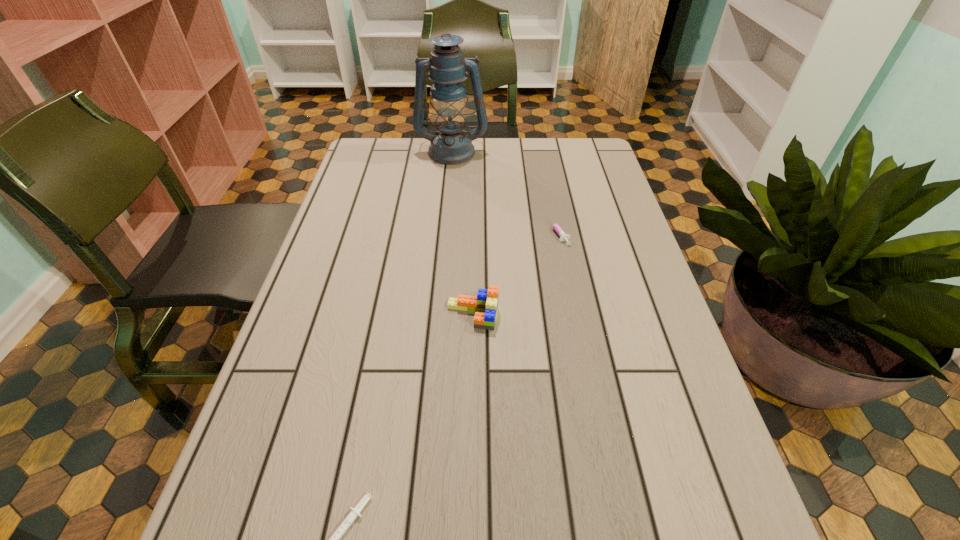
In the image, there is a desktop. At what (x,y) coordinates should I click in order to perform the action: click on free space at the far edge. Please return your answer as a coordinate pair (x, y). Looking at the image, I should click on click(x=455, y=176).

Image resolution: width=960 pixels, height=540 pixels. In the image, there is a desktop. In order to click on vacant space at the left edge in this screenshot , I will do `click(274, 422)`.

Image resolution: width=960 pixels, height=540 pixels. In the image, there is a desktop. Find the location of `vacant region at the right edge`. vacant region at the right edge is located at coordinates (682, 445).

Find the location of `free region at the far left corner of the desktop`. free region at the far left corner of the desktop is located at coordinates pos(404,141).

Find the location of `vacant area at the far right corner of the desktop`. vacant area at the far right corner of the desktop is located at coordinates (564, 168).

Locate an element on the screen. Image resolution: width=960 pixels, height=540 pixels. vacant point located between the farthest object and the second tallest object is located at coordinates (463, 233).

Locate an element on the screen. The width and height of the screenshot is (960, 540). empty space that is in between the third farthest object and the taller syringe is located at coordinates (516, 274).

Locate an element on the screen. This screenshot has width=960, height=540. vacant space that is in between the third shortest object and the right syringe is located at coordinates (516, 274).

In order to click on the third closest object relative to the farthest object in this screenshot , I will do `click(335, 538)`.

Identify which object is the third closest to the shortest object. Please provide its 2D coordinates. Your answer should be formatted as a tuple, i.e. [(x, y)], where the tuple contains the x and y coordinates of a point satisfying the conditions above.

[(450, 145)]